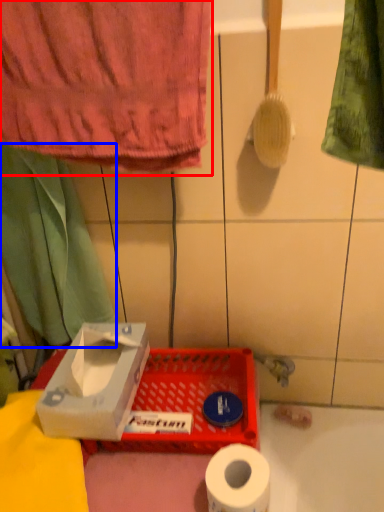
Question: Among these objects, which one is nearest to the camera, towel (highlighted by a red box) or curtain (highlighted by a blue box)?

Choices:
 (A) towel
 (B) curtain

Answer: (A)